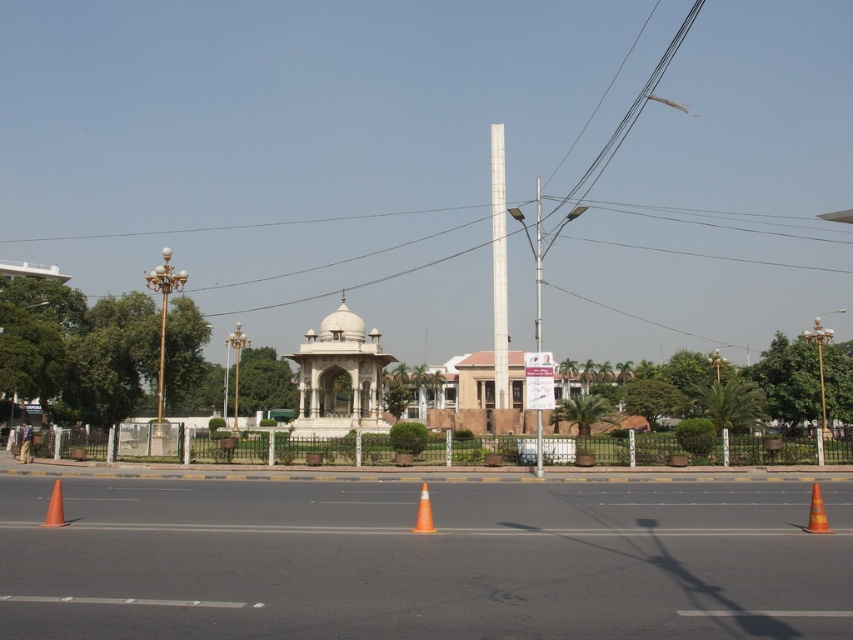
You are standing at the point marked as point [339,378] in the urban street scene. What structure are you currently located on?

The point [339,378] is on the white marble gazebo at center, so you are currently located on the white marble gazebo at center.

You are a pedestrian standing at the edge of the road and want to take a photo of the white marble gazebo at center. However, there is an orange reflective cone at lower right in your way. Can you move the cone to get a clear view?

The white marble gazebo at center is positioned under the orange reflective cone at lower right, so moving the cone would allow you to have a clear view of the gazebo.